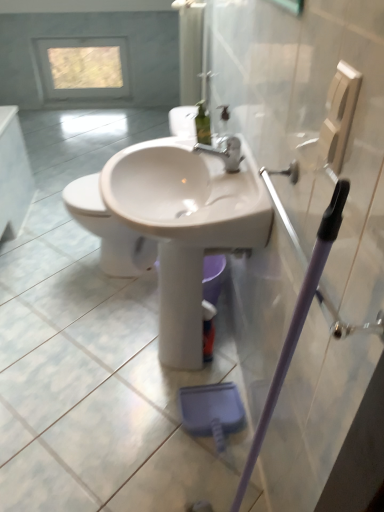
Image resolution: width=384 pixels, height=512 pixels. In order to click on blank area to the left of white glossy toilet at center in this screenshot , I will do `click(44, 270)`.